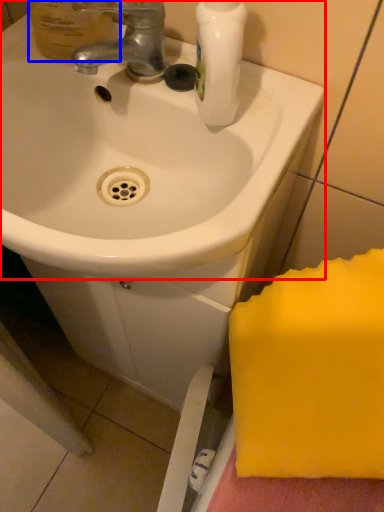
Question: Among these objects, which one is farthest to the camera, sink (highlighted by a red box) or mouthwash (highlighted by a blue box)?

Choices:
 (A) sink
 (B) mouthwash

Answer: (B)